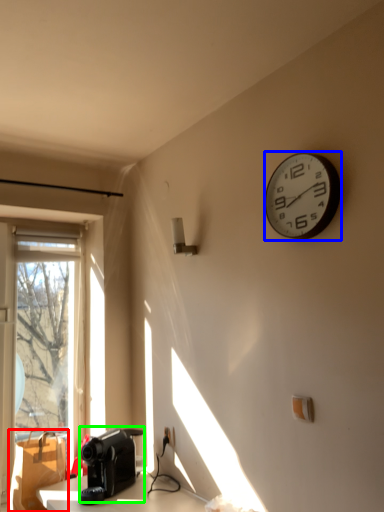
Question: Which object is the closest to the cardboard box (highlighted by a red box)? Choose among these: wall clock (highlighted by a blue box) or appliance (highlighted by a green box).

Choices:
 (A) wall clock
 (B) appliance

Answer: (B)